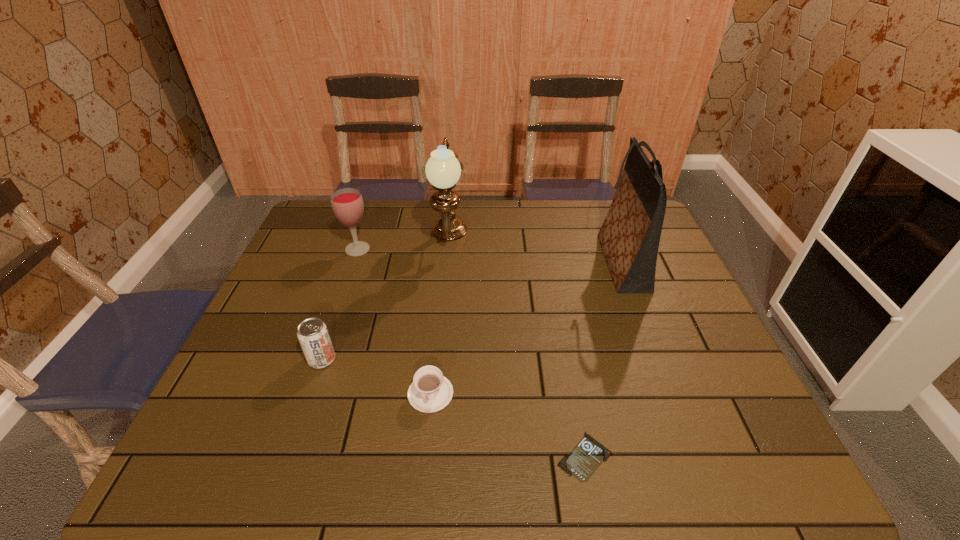
Locate an element on the screen. the rightmost object is located at coordinates (629, 237).

Where is `oil lamp`? oil lamp is located at coordinates (443, 170).

Find the location of a particular element. This screenshot has width=960, height=540. the fourth shortest object is located at coordinates (347, 204).

Locate an element on the screen. soda can is located at coordinates (313, 335).

I want to click on the fourth farthest object, so click(x=313, y=335).

You are a GUI agent. You are given a task and a screenshot of the screen. Output one action in this format:
    pyautogui.click(x=<x>, y=<y>)
    Task: Click on the fifth tallest object
    
    Given the screenshot: What is the action you would take?
    pyautogui.click(x=430, y=391)

The height and width of the screenshot is (540, 960). In order to click on the fifth farthest object in this screenshot , I will do `click(430, 391)`.

Where is `the nearest object`? the nearest object is located at coordinates (586, 457).

In order to click on identity card in this screenshot , I will do `click(586, 457)`.

Identify the location of vacant area located 0.170m on the front-facing side of the shopping bag. The height and width of the screenshot is (540, 960). (540, 262).